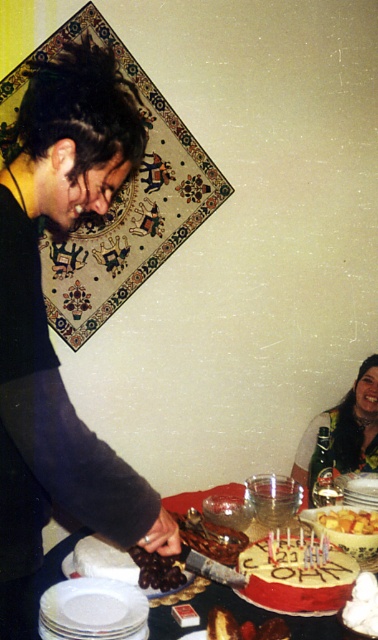
Question: Which point is farther from the camera taking this photo?

Choices:
 (A) (154, 589)
 (B) (325, 570)

Answer: (B)

Question: Is chocolate frosted cake with candles at lower center thinner than yellow cake at lower center?

Choices:
 (A) yes
 (B) no

Answer: (B)

Question: Which point appears closest to the camera in this image?

Choices:
 (A) (75, 129)
 (B) (314, 611)
 (C) (331, 620)
 (D) (106, 579)

Answer: (A)

Question: Does dark brown hair at upper left lie in front of white matte plate at lower left?

Choices:
 (A) no
 (B) yes

Answer: (B)

Question: Which of the following is the farthest from the observer?

Choices:
 (A) white fluffy cake at lower right
 (B) smooth white cake at center

Answer: (A)

Question: Does smooth white cake at center appear on the left side of chocolate-covered nuts at center?

Choices:
 (A) no
 (B) yes

Answer: (B)